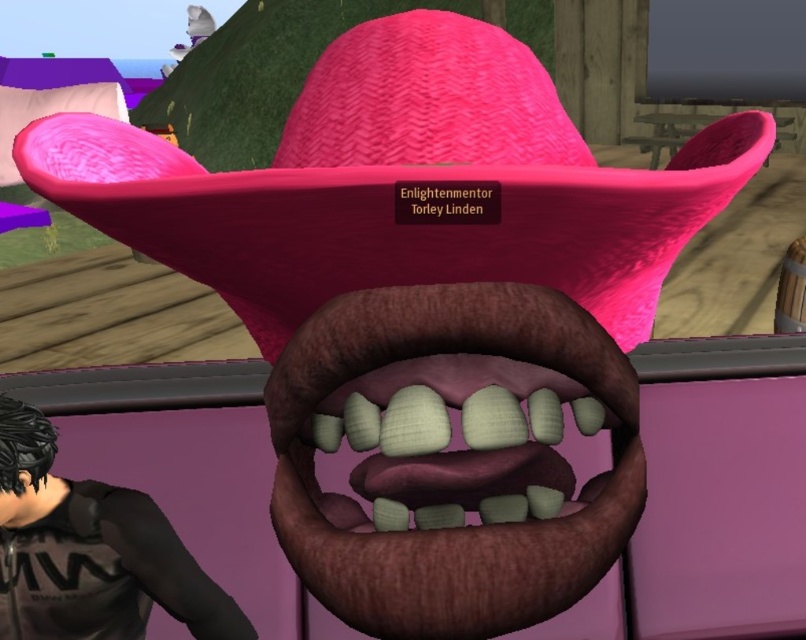
Question: Can you confirm if pink woven hat at center is positioned below smooth brown leather mouth at center?

Choices:
 (A) no
 (B) yes

Answer: (A)

Question: Is pink woven hat at center positioned in front of black matte shirt at lower left?

Choices:
 (A) yes
 (B) no

Answer: (A)

Question: Which of the following is the closest to the observer?

Choices:
 (A) (372, 216)
 (B) (584, 326)

Answer: (A)

Question: Does smooth brown leather mouth at center have a greater width compared to black matte shirt at lower left?

Choices:
 (A) yes
 (B) no

Answer: (B)

Question: Among these points, which one is nearest to the camera?

Choices:
 (A) pos(80,563)
 (B) pos(773,124)
 (C) pos(379,465)

Answer: (C)

Question: Which of the following is the farthest from the observer?

Choices:
 (A) (42, 518)
 (B) (289, 429)
 (C) (422, 264)

Answer: (A)